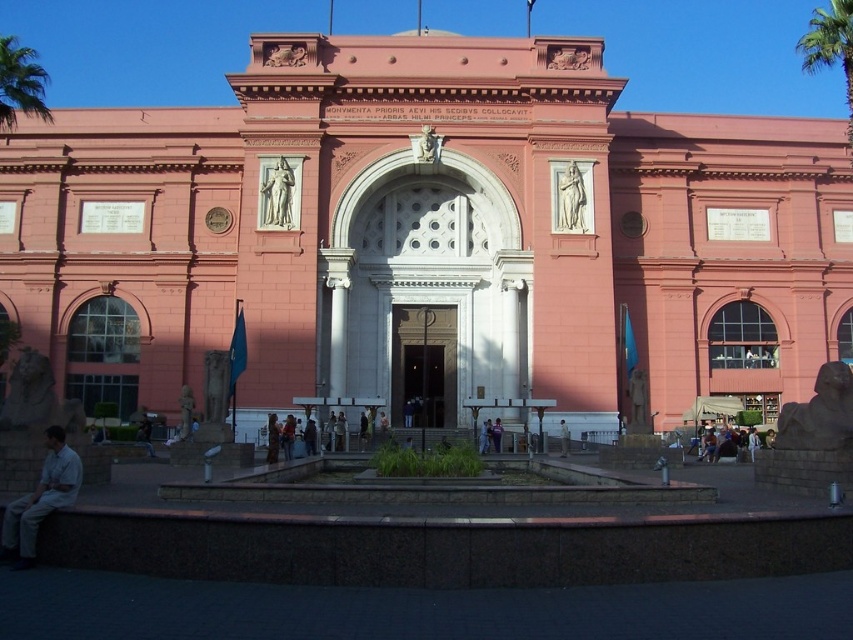
Question: Based on their relative distances, which object is nearer to the green leafy palm tree at upper right?

Choices:
 (A) light brown wooden bench at lower center
 (B) denim jacket at center
 (C) light brown uniform at center

Answer: (A)

Question: Observing the image, what is the correct spatial positioning of light brown wooden bench at lower center in reference to matte bronze statue at center?

Choices:
 (A) right
 (B) left

Answer: (A)

Question: Estimate the real-world distances between objects in this image. Which object is farther from the green leafy palm tree at upper left?

Choices:
 (A) light brown uniform at center
 (B) dark blue jeans at lower left
 (C) white cotton shirt at center
 (D) light blue jeans at center

Answer: (A)

Question: Can you confirm if matte bronze statue at center is bigger than dark blue jeans at lower left?

Choices:
 (A) no
 (B) yes

Answer: (B)

Question: Does matte pink building at center lie in front of denim jacket at center?

Choices:
 (A) yes
 (B) no

Answer: (A)

Question: Which of the following is the farthest from the observer?

Choices:
 (A) (128, 218)
 (B) (561, 426)
 (C) (3, 83)

Answer: (A)